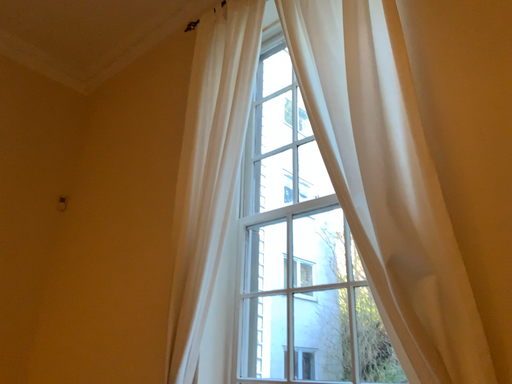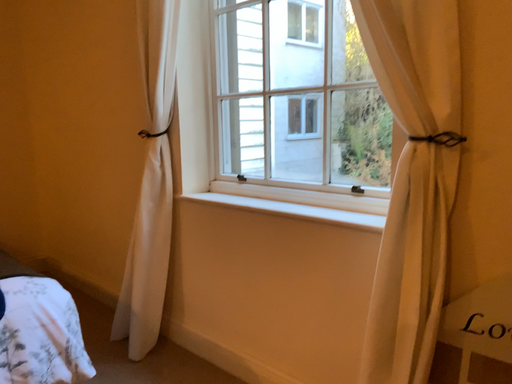
Question: How did the camera likely rotate when shooting the video?

Choices:
 (A) rotated upward
 (B) rotated downward

Answer: (B)